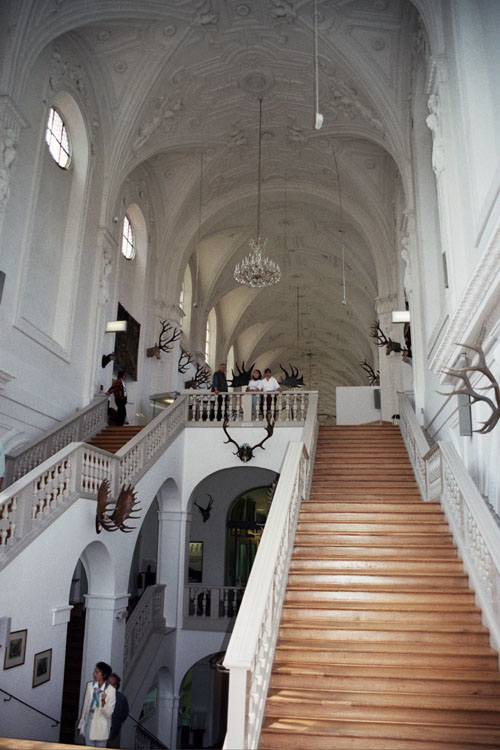
Identify the location of dark gray antlers on wall. This screenshot has height=750, width=500. (269, 433), (227, 434).